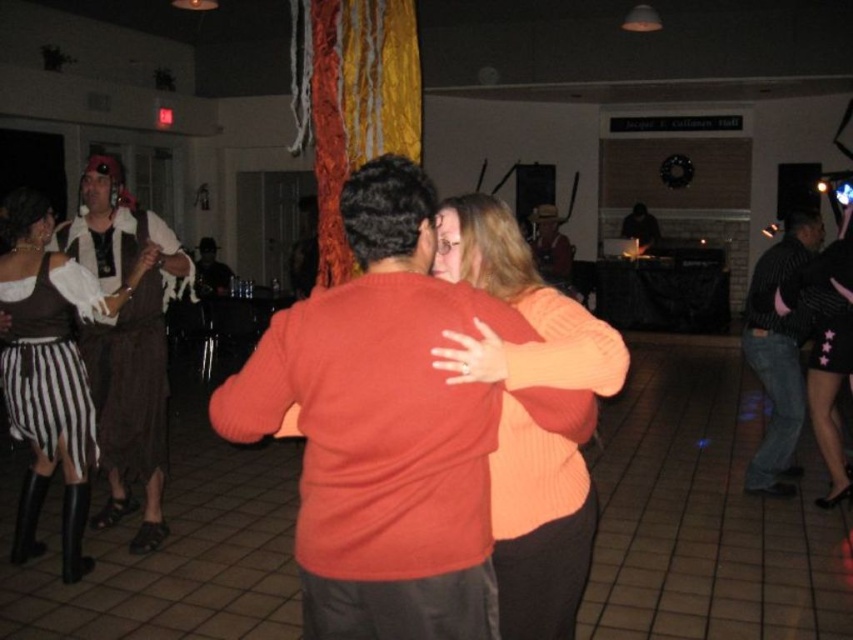
Between knitted sweater at center and knitted peach sweater at center, which one appears on the left side from the viewer's perspective?

Positioned to the left is knitted sweater at center.

How much distance is there between knitted sweater at center and knitted peach sweater at center?

knitted sweater at center and knitted peach sweater at center are 6.77 inches apart.

Does point (403, 529) come in front of point (521, 419)?

That is True.

What are the coordinates of `knitted sweater at center` in the screenshot? It's located at (384, 428).

Which is below, knitted peach sweater at center or brown leather jacket at center?

Positioned lower is knitted peach sweater at center.

In the scene shown: Which is more to the right, knitted peach sweater at center or brown leather jacket at center?

brown leather jacket at center

The image size is (853, 640). In order to click on knitted peach sweater at center in this screenshot , I will do `click(529, 417)`.

Between knitted peach sweater at center and black striped shirt at right, which one has less height?

Standing shorter between the two is knitted peach sweater at center.

Does point (595, 323) come farther from viewer compared to point (764, 442)?

No, it is not.

In order to click on knitted peach sweater at center in this screenshot , I will do `click(529, 417)`.

This screenshot has height=640, width=853. Find the location of `knitted peach sweater at center`. knitted peach sweater at center is located at coordinates (529, 417).